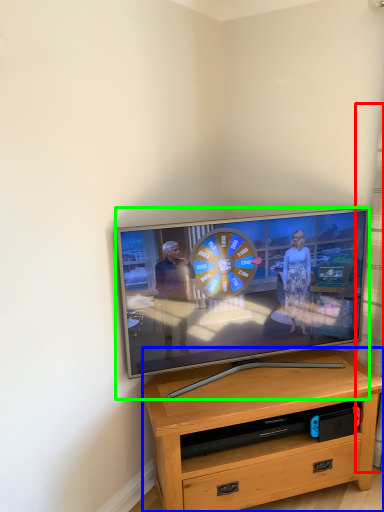
Question: Considering the real-world distances, which object is farthest from curtain (highlighted by a red box)? desk (highlighted by a blue box) or television (highlighted by a green box)?

Choices:
 (A) desk
 (B) television

Answer: (A)